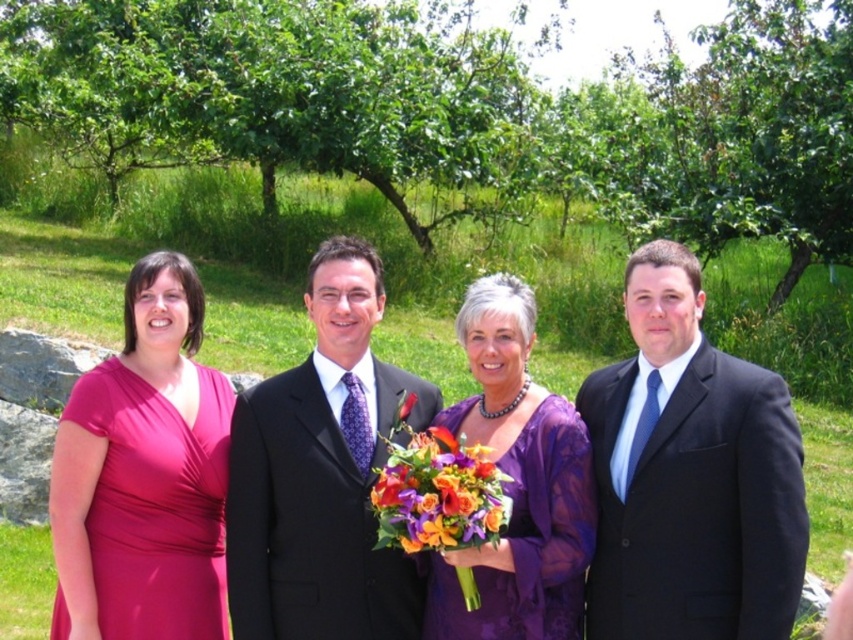
You are planning to take a group photo of the matte black suit at right and the matte pink dress at left. Which person should stand in the front row to ensure both are fully visible?

The matte black suit at right is not as tall as the matte pink dress at left, so the shorter person, the matte black suit at right, should stand in the front row to ensure both are fully visible.

You are a photographer setting up for a group photo in the garden. You have to ensure that the matte black suit at right and the vibrant silk bouquet at center are both in the frame. Based on their positions, which object is closer to the left edge of the photo?

The vibrant silk bouquet at center is closer to the left edge of the photo because the matte black suit at right is positioned on the right side of it.